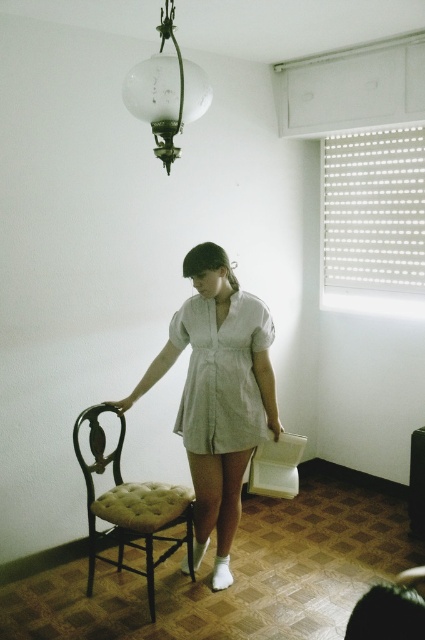
Is white cotton dress at center positioned in front of translucent glass globe at upper center?

No, white cotton dress at center is further to the viewer.

Does white cotton dress at center have a smaller size compared to translucent glass globe at upper center?

No, white cotton dress at center is not smaller than translucent glass globe at upper center.

Who is more distant from viewer, [266,404] or [195,67]?

Positioned behind is point [266,404].

Locate an element on the screen. This screenshot has height=640, width=425. white cotton dress at center is located at coordinates (x=218, y=394).

Does light green linen dress at center appear on the left side of translucent glass globe at upper center?

No, light green linen dress at center is not to the left of translucent glass globe at upper center.

Where is `light green linen dress at center`? light green linen dress at center is located at coordinates (221, 372).

Is point (261, 344) more distant than point (138, 518)?

That is True.

Between light green linen dress at center and tufted fabric armchair at center, which one is positioned higher?

light green linen dress at center is higher up.

Does point (246, 310) come behind point (136, 529)?

That is True.

Image resolution: width=425 pixels, height=640 pixels. I want to click on light green linen dress at center, so click(221, 372).